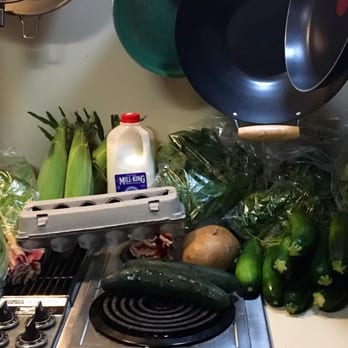
At what (x,y) coordinates should I click in order to perform the action: click on exhaust fan. Please return your answer as a coordinate pair (x, y). Image resolution: width=348 pixels, height=348 pixels. Looking at the image, I should click on (62, 272).